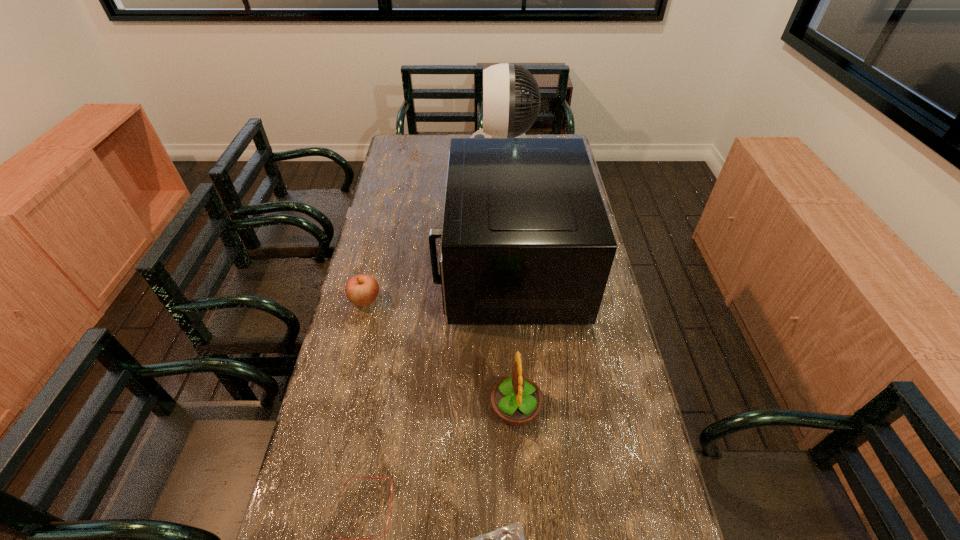
Where is `free space located on the front-facing side of the microwave_oven`? The height and width of the screenshot is (540, 960). free space located on the front-facing side of the microwave_oven is located at coordinates [397, 266].

Locate an element on the screen. This screenshot has width=960, height=540. vacant space located on the front-facing side of the microwave_oven is located at coordinates (392, 266).

I want to click on vacant space situated on the face of the third tallest object, so click(471, 408).

Identify the location of vacant area located 0.110m on the face of the third tallest object. (448, 408).

Where is `free space located 0.190m on the face of the third tallest object`? This screenshot has width=960, height=540. free space located 0.190m on the face of the third tallest object is located at coordinates (418, 408).

Find the location of a particular element. This screenshot has width=960, height=540. vacant space located 0.350m on the right of the fourth tallest object is located at coordinates (491, 300).

Where is `object present at the far edge`? This screenshot has width=960, height=540. object present at the far edge is located at coordinates (501, 101).

Identify the location of object located at the left edge. The image size is (960, 540). (361, 290).

Where is `fan present at the right edge`? Image resolution: width=960 pixels, height=540 pixels. fan present at the right edge is located at coordinates (501, 101).

Where is `microwave_oven positioned at the right edge`? Image resolution: width=960 pixels, height=540 pixels. microwave_oven positioned at the right edge is located at coordinates (526, 239).